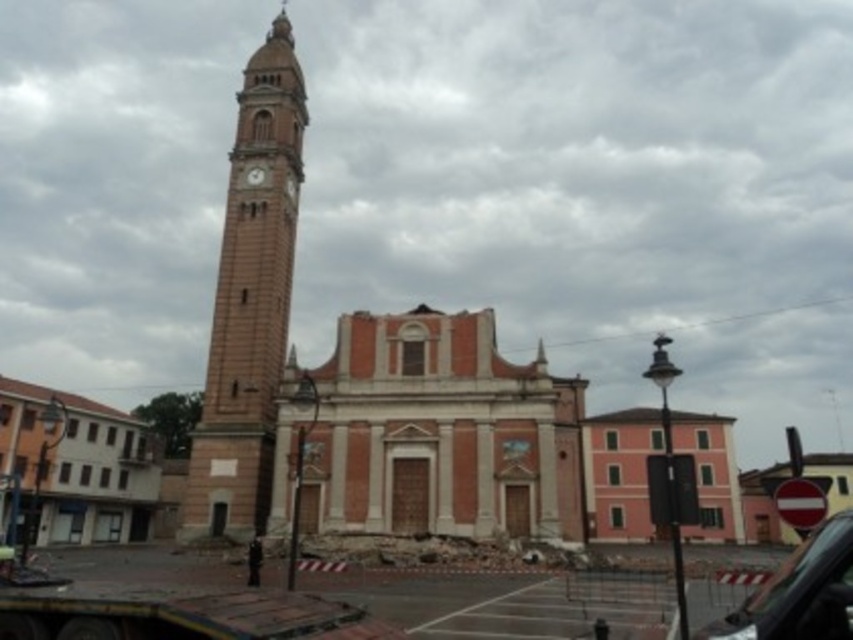
You are a tourist standing in the town square and want to take a photo of the matte pink building at left and the black glossy car at center. Which object should you focus on first if you want to capture both in the same frame without moving your camera?

You should focus on the matte pink building at left first because it is much taller than the black glossy car at center, so adjusting the camera angle to include its height will naturally include the car in the frame.

You are a photographer planning to take a wide shot of the historic church and its surroundings. You notice the matte pink building at left and the black glossy car at center in your frame. Based on their sizes in the image, which object would you adjust your camera angle to prioritize capturing more clearly?

The matte pink building at left occupies less space than the black glossy car at center, so you should adjust your camera angle to prioritize capturing the smaller matte pink building at left more clearly.